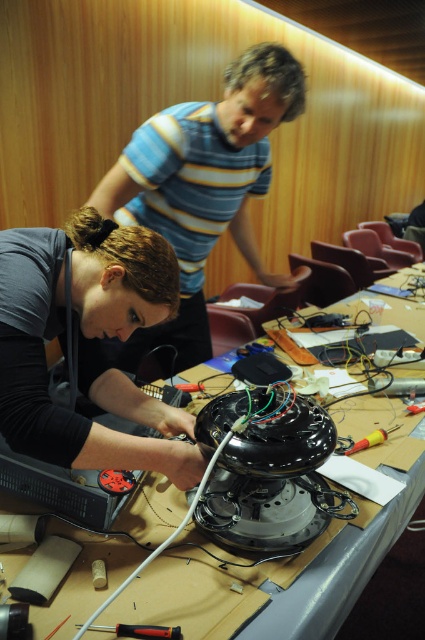
Question: Among these objects, which one is farthest from the camera?

Choices:
 (A) matte black hair at lower left
 (B) yellow plastic screwdriver at center
 (C) striped cotton shirt at upper center
 (D) metallic screwdriver at lower center

Answer: (C)

Question: Does matte black hair at lower left appear on the left side of striped cotton shirt at upper center?

Choices:
 (A) yes
 (B) no

Answer: (A)

Question: Is matte black hair at lower left bigger than yellow plastic screwdriver at center?

Choices:
 (A) no
 (B) yes

Answer: (B)

Question: Estimate the real-world distances between objects in this image. Which object is farther from the striped cotton shirt at upper center?

Choices:
 (A) matte black hair at lower left
 (B) metallic screwdriver at lower center
 (C) yellow plastic screwdriver at center

Answer: (B)

Question: Is matte black hair at lower left below yellow plastic screwdriver at center?

Choices:
 (A) yes
 (B) no

Answer: (B)

Question: Which point is farther to the camera?

Choices:
 (A) matte black hair at lower left
 (B) yellow plastic screwdriver at center
 (C) metallic screwdriver at lower center

Answer: (B)